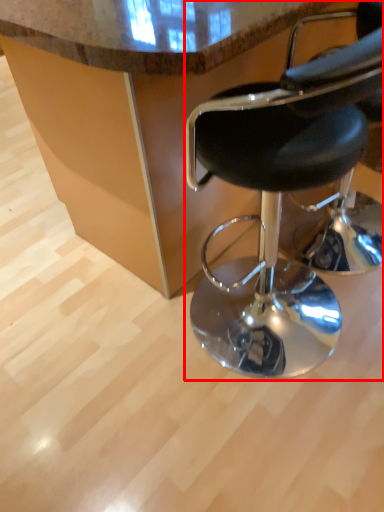
Question: From the image, what is the correct spatial relationship of chair (annotated by the red box) in relation to table?

Choices:
 (A) right
 (B) left

Answer: (B)